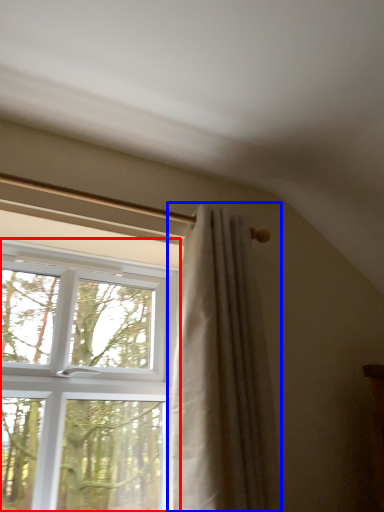
Question: Which point is closer to the camera, window (highlighted by a red box) or curtain (highlighted by a blue box)?

Choices:
 (A) window
 (B) curtain

Answer: (A)